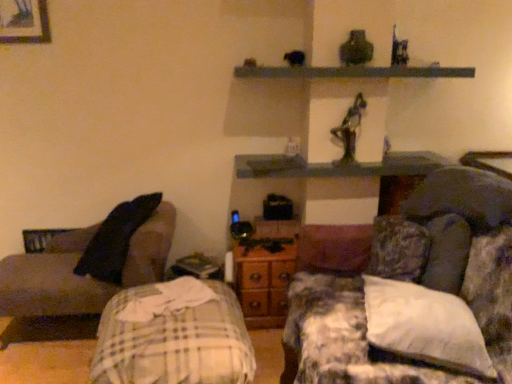
Where is `free space above plaid fabric bed at lower left (from a real-world perspective)`? This screenshot has width=512, height=384. free space above plaid fabric bed at lower left (from a real-world perspective) is located at coordinates (160, 314).